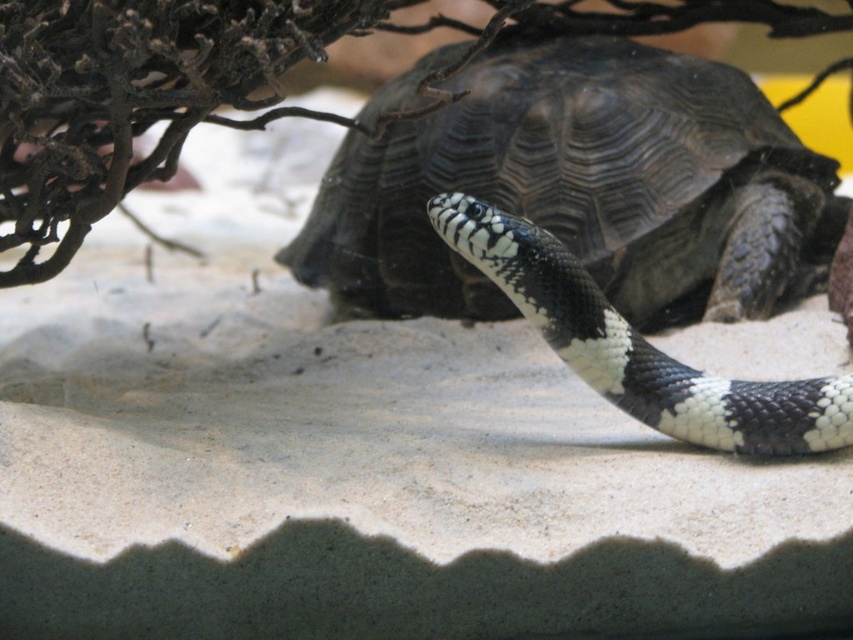
Identify the location of shiny black tortoise at center. (582, 188).

Is point (758, 195) farther from viewer compared to point (480, 260)?

Yes, it is.

The image size is (853, 640). In order to click on shiny black tortoise at center in this screenshot , I will do `click(582, 188)`.